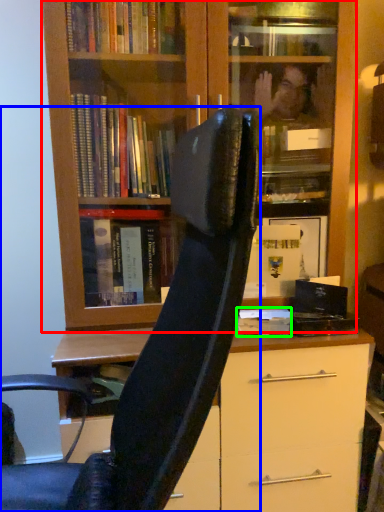
Question: Considering the real-world distances, which object is farthest from bookcase (highlighted by a red box)? chair (highlighted by a blue box) or paperback book (highlighted by a green box)?

Choices:
 (A) chair
 (B) paperback book

Answer: (B)